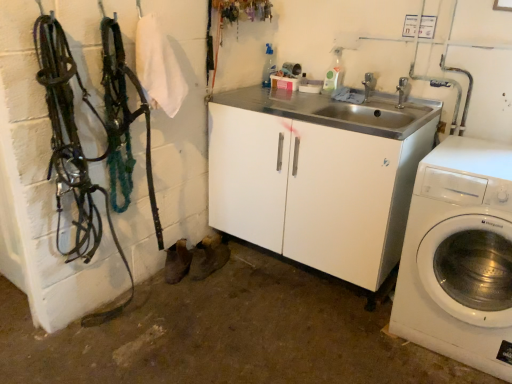
Question: Considering the relative positions of silver metallic faucet at upper center, positioned as the 2th faucet in right-to-left order, and white plastic washing machine at right in the image provided, is silver metallic faucet at upper center, positioned as the 2th faucet in right-to-left order, to the right of white plastic washing machine at right from the viewer's perspective?

Choices:
 (A) no
 (B) yes

Answer: (A)

Question: Is silver metallic faucet at upper center, positioned as the 2th faucet in right-to-left order, closer to camera compared to white plastic washing machine at right?

Choices:
 (A) yes
 (B) no

Answer: (B)

Question: Can you confirm if silver metallic faucet at upper center, which is counted as the 1th faucet, starting from the left, is smaller than white plastic washing machine at right?

Choices:
 (A) yes
 (B) no

Answer: (A)

Question: Is silver metallic faucet at upper center, positioned as the 2th faucet in right-to-left order, taller than white plastic washing machine at right?

Choices:
 (A) no
 (B) yes

Answer: (A)

Question: Considering the relative sizes of silver metallic faucet at upper center, positioned as the 2th faucet in right-to-left order, and white plastic washing machine at right in the image provided, is silver metallic faucet at upper center, positioned as the 2th faucet in right-to-left order, shorter than white plastic washing machine at right?

Choices:
 (A) no
 (B) yes

Answer: (B)

Question: Is silver metallic faucet at upper center, which is counted as the 1th faucet, starting from the left, in front of or behind white plastic washing machine at right in the image?

Choices:
 (A) front
 (B) behind

Answer: (B)

Question: Considering the positions of silver metallic faucet at upper center, which is counted as the 1th faucet, starting from the left, and white plastic washing machine at right in the image, is silver metallic faucet at upper center, which is counted as the 1th faucet, starting from the left, bigger or smaller than white plastic washing machine at right?

Choices:
 (A) big
 (B) small

Answer: (B)

Question: In terms of width, does silver metallic faucet at upper center, the 2th faucet from the front, look wider or thinner when compared to white plastic washing machine at right?

Choices:
 (A) wide
 (B) thin

Answer: (B)

Question: Visually, is silver metallic faucet at upper center, the 2th faucet from the front, positioned to the left or to the right of white plastic washing machine at right?

Choices:
 (A) right
 (B) left

Answer: (B)

Question: Does point (415, 215) appear closer or farther from the camera than point (370, 72)?

Choices:
 (A) farther
 (B) closer

Answer: (B)

Question: Is white plastic washing machine at right spatially inside silver metallic faucet at upper center, which is counted as the 1th faucet, starting from the left, or outside of it?

Choices:
 (A) outside
 (B) inside

Answer: (A)

Question: Considering their positions, is white plastic washing machine at right located in front of or behind silver metallic faucet at upper center, positioned as the 1th faucet in back-to-front order?

Choices:
 (A) behind
 (B) front

Answer: (B)

Question: Is white plastic washing machine at right taller or shorter than silver metallic faucet at upper center, which is counted as the 1th faucet, starting from the left?

Choices:
 (A) short
 (B) tall

Answer: (B)

Question: Is silver metallic faucet at upper center, the second faucet in the back-to-front sequence, situated inside white plastic washing machine at right or outside?

Choices:
 (A) inside
 (B) outside

Answer: (B)

Question: In terms of size, does silver metallic faucet at upper center, acting as the second faucet starting from the left, appear bigger or smaller than white plastic washing machine at right?

Choices:
 (A) big
 (B) small

Answer: (B)